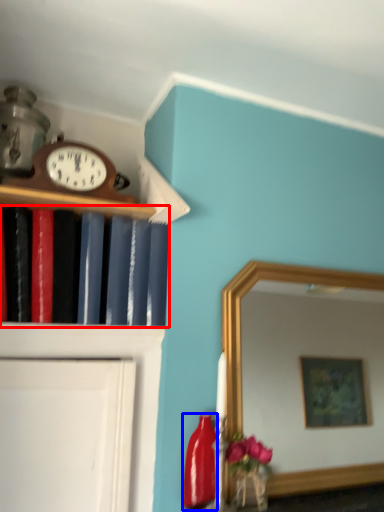
Question: Which object is further to the camera taking this photo, book (highlighted by a red box) or bottle (highlighted by a blue box)?

Choices:
 (A) book
 (B) bottle

Answer: (B)